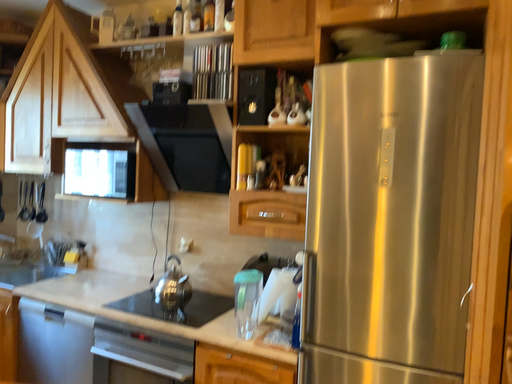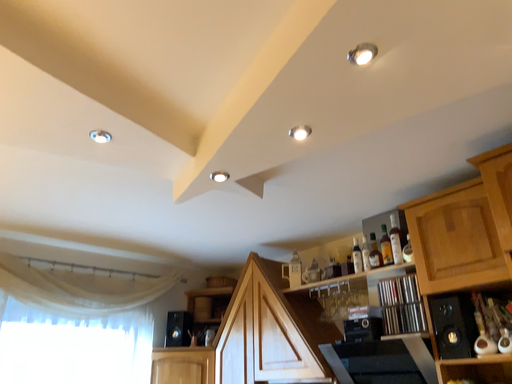
Question: Which way did the camera rotate in the video?

Choices:
 (A) rotated downward
 (B) rotated upward

Answer: (B)